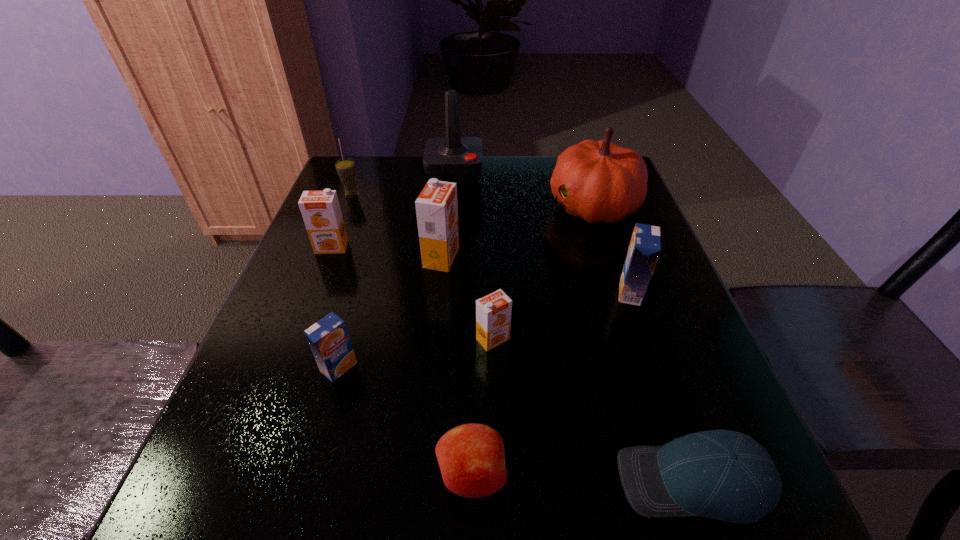
Identify the location of the eighth farthest object. (329, 340).

The image size is (960, 540). Identify the location of the rightmost orange orange juice. (493, 312).

Identify the location of the smallest orange orange juice. The image size is (960, 540). (493, 312).

Locate an element on the screen. This screenshot has width=960, height=540. the ninth tallest object is located at coordinates coord(471,457).

Identify the location of red apple. This screenshot has height=540, width=960. (471, 457).

This screenshot has height=540, width=960. What are the coordinates of `the shortest object` in the screenshot? It's located at (725, 475).

At what (x,y) coordinates should I click in order to perform the action: click on light baseball cap. Please return your answer as a coordinate pair (x, y). Looking at the image, I should click on (725, 475).

Identify the location of vacant space located 0.310m on the front of the joystick. Image resolution: width=960 pixels, height=540 pixels. (447, 260).

The height and width of the screenshot is (540, 960). I want to click on vacant point located 0.160m on the front-facing side of the pink pumpkin, so click(x=485, y=205).

Locate an element on the screen. Image resolution: width=960 pixels, height=540 pixels. vacant space located 0.300m on the front-facing side of the pink pumpkin is located at coordinates (430, 205).